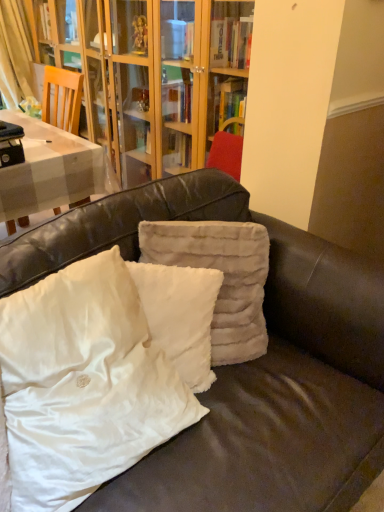
In order to face white fluffy pillow at center, which ranks as the 2th pillow in left-to-right order, should I rotate leftwards or rightwards?

To face it directly, rotate left by 1.453 degrees.

Identify the location of white fluffy pillow at center, the first pillow in the left-to-right sequence. This screenshot has height=512, width=384. (83, 384).

Considering the relative sizes of white fluffy pillow at center, positioned as the third pillow in right-to-left order, and white fluffy pillow at center, marked as the 2th pillow in a right-to-left arrangement, in the image provided, is white fluffy pillow at center, positioned as the third pillow in right-to-left order, bigger than white fluffy pillow at center, marked as the 2th pillow in a right-to-left arrangement,?

Yes, white fluffy pillow at center, positioned as the third pillow in right-to-left order, is bigger than white fluffy pillow at center, marked as the 2th pillow in a right-to-left arrangement.

Is white fluffy pillow at center, positioned as the third pillow in right-to-left order, aimed at white fluffy pillow at center, marked as the 2th pillow in a right-to-left arrangement?

No, white fluffy pillow at center, positioned as the third pillow in right-to-left order, is not oriented towards white fluffy pillow at center, marked as the 2th pillow in a right-to-left arrangement.

Which point is more forward, (119, 435) or (157, 336)?

The point (119, 435) is closer to the camera.

From a real-world perspective, between white fluffy pillow at center, positioned as the third pillow in right-to-left order, and white fluffy pillow at center, which ranks as the 2th pillow in left-to-right order, who is vertically higher?

white fluffy pillow at center, positioned as the third pillow in right-to-left order, is physically above.

Is white fluffy pillow at center, marked as the 2th pillow in a right-to-left arrangement, positioned beyond the bounds of white fluffy pillow at center, the first pillow in the left-to-right sequence?

Yes.

Could you tell me if white fluffy pillow at center, which ranks as the 2th pillow in left-to-right order, is turned towards white fluffy pillow at center, the first pillow in the left-to-right sequence?

Yes, white fluffy pillow at center, which ranks as the 2th pillow in left-to-right order, is oriented towards white fluffy pillow at center, the first pillow in the left-to-right sequence.

Which is less distant, [203,268] or [193,401]?

Clearly, point [203,268] is more distant from the camera than point [193,401].

This screenshot has width=384, height=512. In order to click on pillow that is the 2nd object located in front of the fuzzy beige pillow at center, which is counted as the 3th pillow, starting from the left in this screenshot , I will do `click(83, 384)`.

Can you confirm if white fluffy pillow at center, positioned as the third pillow in right-to-left order, is thinner than fuzzy beige pillow at center, which ranks as the first pillow in right-to-left order?

In fact, white fluffy pillow at center, positioned as the third pillow in right-to-left order, might be wider than fuzzy beige pillow at center, which ranks as the first pillow in right-to-left order.

Can you tell me how much white fluffy pillow at center, positioned as the third pillow in right-to-left order, and fuzzy beige pillow at center, which ranks as the first pillow in right-to-left order, differ in facing direction?

The angular difference between white fluffy pillow at center, positioned as the third pillow in right-to-left order, and fuzzy beige pillow at center, which ranks as the first pillow in right-to-left order, is 29.7 degrees.

In the image, is white fluffy pillow at center, positioned as the third pillow in right-to-left order, on the left side or the right side of fuzzy beige pillow at center, which ranks as the first pillow in right-to-left order?

white fluffy pillow at center, positioned as the third pillow in right-to-left order, is to the left of fuzzy beige pillow at center, which ranks as the first pillow in right-to-left order.

Is white fluffy pillow at center, which ranks as the 2th pillow in left-to-right order, next to fuzzy beige pillow at center, which ranks as the first pillow in right-to-left order?

white fluffy pillow at center, which ranks as the 2th pillow in left-to-right order, and fuzzy beige pillow at center, which ranks as the first pillow in right-to-left order, are not in contact.

Based on the photo, from a real-world perspective, is white fluffy pillow at center, which ranks as the 2th pillow in left-to-right order, positioned under fuzzy beige pillow at center, which ranks as the first pillow in right-to-left order, based on gravity?

Correct, in the physical world, white fluffy pillow at center, which ranks as the 2th pillow in left-to-right order, is lower than fuzzy beige pillow at center, which ranks as the first pillow in right-to-left order.

Based on the photo, is white fluffy pillow at center, marked as the 2th pillow in a right-to-left arrangement, at the right side of fuzzy beige pillow at center, which ranks as the first pillow in right-to-left order?

Incorrect, white fluffy pillow at center, marked as the 2th pillow in a right-to-left arrangement, is not on the right side of fuzzy beige pillow at center, which ranks as the first pillow in right-to-left order.

At what (x,y) coordinates should I click in order to perform the action: click on pillow on the right of the white fluffy pillow at center, marked as the 2th pillow in a right-to-left arrangement. Please return your answer as a coordinate pair (x, y). Looking at the image, I should click on (224, 277).

Who is taller, fuzzy beige pillow at center, which is counted as the 3th pillow, starting from the left, or white fluffy pillow at center, positioned as the third pillow in right-to-left order?

Standing taller between the two is white fluffy pillow at center, positioned as the third pillow in right-to-left order.

Is fuzzy beige pillow at center, which is counted as the 3th pillow, starting from the left, facing towards white fluffy pillow at center, positioned as the third pillow in right-to-left order?

No, fuzzy beige pillow at center, which is counted as the 3th pillow, starting from the left, does not turn towards white fluffy pillow at center, positioned as the third pillow in right-to-left order.

Based on the photo, how much distance is there between fuzzy beige pillow at center, which ranks as the first pillow in right-to-left order, and white fluffy pillow at center, the first pillow in the left-to-right sequence?

A distance of 14.02 inches exists between fuzzy beige pillow at center, which ranks as the first pillow in right-to-left order, and white fluffy pillow at center, the first pillow in the left-to-right sequence.

How different are the orientations of fuzzy beige pillow at center, which is counted as the 3th pillow, starting from the left, and white fluffy pillow at center, positioned as the third pillow in right-to-left order, in degrees?

The angular difference between fuzzy beige pillow at center, which is counted as the 3th pillow, starting from the left, and white fluffy pillow at center, positioned as the third pillow in right-to-left order, is 29.7 degrees.

This screenshot has height=512, width=384. What are the coordinates of `the 1st pillow positioned below the fuzzy beige pillow at center, which is counted as the 3th pillow, starting from the left (from the image's perspective)` in the screenshot? It's located at (180, 315).

Is fuzzy beige pillow at center, which ranks as the first pillow in right-to-left order, facing away from white fluffy pillow at center, which ranks as the 2th pillow in left-to-right order?

Yes, white fluffy pillow at center, which ranks as the 2th pillow in left-to-right order, is at the back of fuzzy beige pillow at center, which ranks as the first pillow in right-to-left order.

Does fuzzy beige pillow at center, which ranks as the first pillow in right-to-left order, have a smaller size compared to white fluffy pillow at center, marked as the 2th pillow in a right-to-left arrangement?

No, fuzzy beige pillow at center, which ranks as the first pillow in right-to-left order, is not smaller than white fluffy pillow at center, marked as the 2th pillow in a right-to-left arrangement.

This screenshot has width=384, height=512. Identify the location of pillow that is the 1st object above the white fluffy pillow at center, marked as the 2th pillow in a right-to-left arrangement (from a real-world perspective). tap(83, 384).

Where is `pillow below the white fluffy pillow at center, which ranks as the 2th pillow in left-to-right order (from the image's perspective)`? The height and width of the screenshot is (512, 384). pillow below the white fluffy pillow at center, which ranks as the 2th pillow in left-to-right order (from the image's perspective) is located at coordinates (83, 384).

Consider the image. When comparing their distances from white fluffy pillow at center, positioned as the third pillow in right-to-left order, does white fluffy pillow at center, marked as the 2th pillow in a right-to-left arrangement, or fuzzy beige pillow at center, which is counted as the 3th pillow, starting from the left, seem further?

Among the two, fuzzy beige pillow at center, which is counted as the 3th pillow, starting from the left, is located further to white fluffy pillow at center, positioned as the third pillow in right-to-left order.

Which object lies nearer to the anchor point white fluffy pillow at center, positioned as the third pillow in right-to-left order, fuzzy beige pillow at center, which is counted as the 3th pillow, starting from the left, or white fluffy pillow at center, which ranks as the 2th pillow in left-to-right order?

Among the two, white fluffy pillow at center, which ranks as the 2th pillow in left-to-right order, is located nearer to white fluffy pillow at center, positioned as the third pillow in right-to-left order.

Based on their spatial positions, is white fluffy pillow at center, the first pillow in the left-to-right sequence, or fuzzy beige pillow at center, which is counted as the 3th pillow, starting from the left, closer to white fluffy pillow at center, which ranks as the 2th pillow in left-to-right order?

The object closer to white fluffy pillow at center, which ranks as the 2th pillow in left-to-right order, is fuzzy beige pillow at center, which is counted as the 3th pillow, starting from the left.

Based on their spatial positions, is white fluffy pillow at center, the first pillow in the left-to-right sequence, or white fluffy pillow at center, which ranks as the 2th pillow in left-to-right order, closer to fuzzy beige pillow at center, which ranks as the first pillow in right-to-left order?

white fluffy pillow at center, which ranks as the 2th pillow in left-to-right order, is closer to fuzzy beige pillow at center, which ranks as the first pillow in right-to-left order.

When comparing their distances from fuzzy beige pillow at center, which ranks as the first pillow in right-to-left order, does white fluffy pillow at center, which ranks as the 2th pillow in left-to-right order, or white fluffy pillow at center, the first pillow in the left-to-right sequence, seem further?

white fluffy pillow at center, the first pillow in the left-to-right sequence, is further to fuzzy beige pillow at center, which ranks as the first pillow in right-to-left order.

Looking at the image, which one is located further to white fluffy pillow at center, which ranks as the 2th pillow in left-to-right order, fuzzy beige pillow at center, which is counted as the 3th pillow, starting from the left, or white fluffy pillow at center, the first pillow in the left-to-right sequence?

Among the two, white fluffy pillow at center, the first pillow in the left-to-right sequence, is located further to white fluffy pillow at center, which ranks as the 2th pillow in left-to-right order.

Find the location of `pillow between white fluffy pillow at center, positioned as the third pillow in right-to-left order, and fuzzy beige pillow at center, which ranks as the first pillow in right-to-left order, along the z-axis`. pillow between white fluffy pillow at center, positioned as the third pillow in right-to-left order, and fuzzy beige pillow at center, which ranks as the first pillow in right-to-left order, along the z-axis is located at coordinates (180, 315).